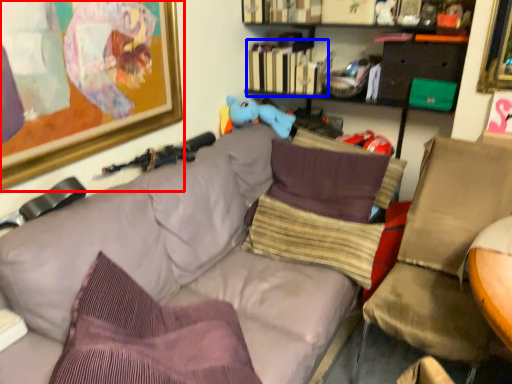
Question: Which object appears farthest to the camera in this image, picture frame (highlighted by a red box) or book (highlighted by a blue box)?

Choices:
 (A) picture frame
 (B) book

Answer: (B)